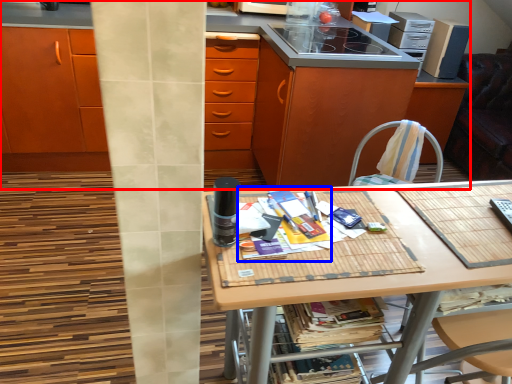
Question: Among these objects, which one is farthest to the camera, cabinetry (highlighted by a red box) or magazine (highlighted by a blue box)?

Choices:
 (A) cabinetry
 (B) magazine

Answer: (A)